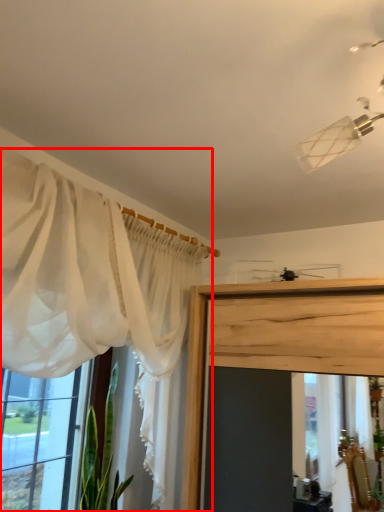
Question: From the image, what is the correct spatial relationship of curtain (annotated by the red box) in relation to window?

Choices:
 (A) right
 (B) left

Answer: (A)